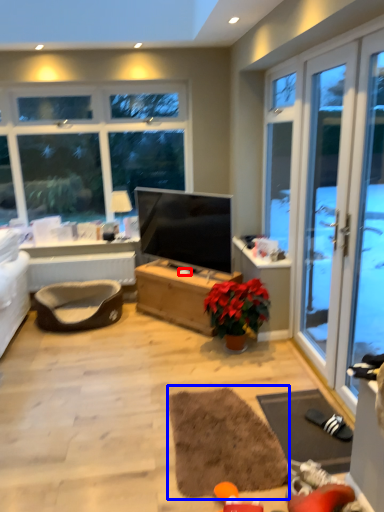
Question: Which point is further to the camera, loudspeaker (highlighted by a red box) or yoga mat (highlighted by a blue box)?

Choices:
 (A) loudspeaker
 (B) yoga mat

Answer: (A)